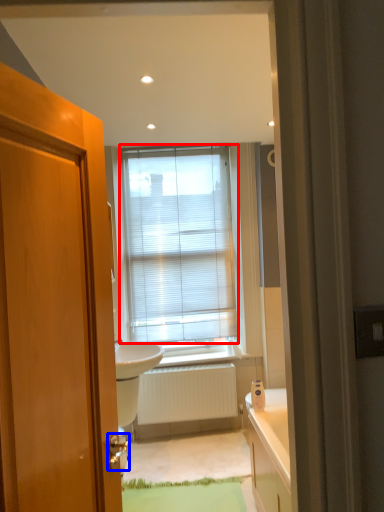
Question: Which object is closer to the camera taking this photo, window blind (highlighted by a red box) or door handle (highlighted by a blue box)?

Choices:
 (A) window blind
 (B) door handle

Answer: (B)